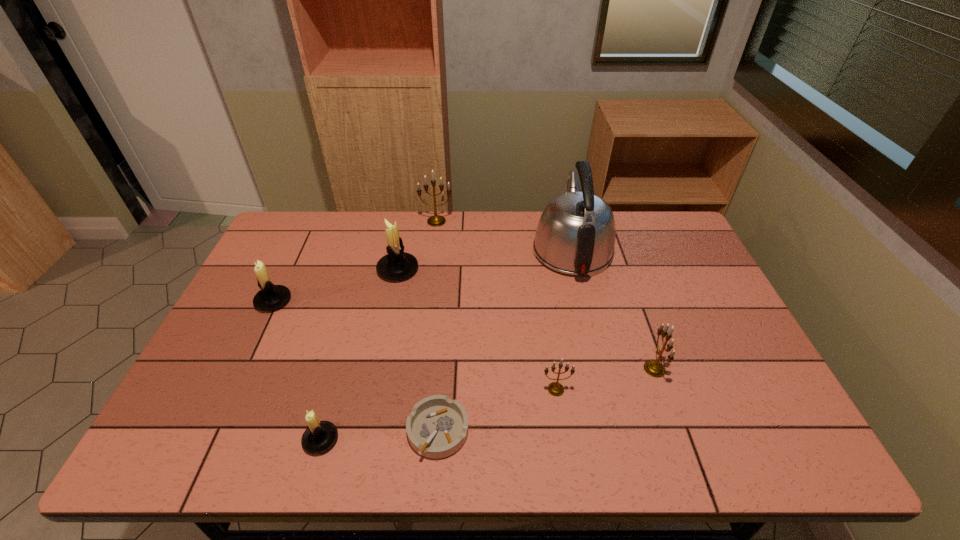
Find the location of `the smallest gold candelabrum`. the smallest gold candelabrum is located at coordinates (556, 389).

Image resolution: width=960 pixels, height=540 pixels. Find the location of `the fifth candle holder from left to right`. the fifth candle holder from left to right is located at coordinates (556, 389).

Identify the location of the smallest white candle holder. This screenshot has height=540, width=960. (320, 436).

This screenshot has width=960, height=540. Find the location of `the nearest candle holder`. the nearest candle holder is located at coordinates (320, 436).

The width and height of the screenshot is (960, 540). I want to click on ashtray, so click(x=437, y=427).

Where is `vacant space situated 0.160m on the front of the farthest candle holder`? The height and width of the screenshot is (540, 960). vacant space situated 0.160m on the front of the farthest candle holder is located at coordinates (432, 256).

At what (x,y) coordinates should I click in order to perform the action: click on free space located on the left of the second farthest candle holder. Please return your answer as a coordinate pair (x, y). This screenshot has height=540, width=960. Looking at the image, I should click on (324, 269).

I want to click on free space located 0.140m on the back of the fourth farthest object, so click(294, 259).

Find the location of a particular element. free location located on the back of the rightmost gold candelabrum is located at coordinates (622, 276).

This screenshot has height=540, width=960. What are the coordinates of `vacant space located on the front of the second candle holder from right to left` in the screenshot? It's located at (562, 427).